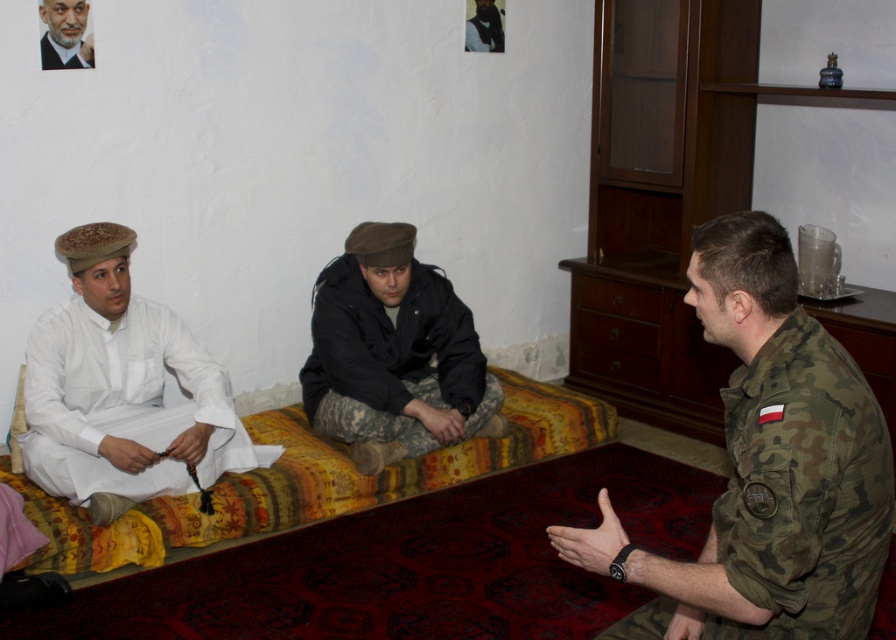
From the picture: Can you confirm if carpeted couch at center is thinner than smooth white robe at left?

No, carpeted couch at center is not thinner than smooth white robe at left.

Does point (291, 525) come closer to viewer compared to point (80, 42)?

No.

Locate an element on the screen. Image resolution: width=896 pixels, height=640 pixels. carpeted couch at center is located at coordinates (306, 481).

What are the coordinates of `carpeted couch at center` in the screenshot? It's located at (306, 481).

Does point (289, 433) come behind point (461, 336)?

No.

Where is `carpeted couch at center`? This screenshot has height=640, width=896. carpeted couch at center is located at coordinates (306, 481).

Is carpeted couch at center to the right of dark brown leather jacket at upper center from the viewer's perspective?

Incorrect, carpeted couch at center is not on the right side of dark brown leather jacket at upper center.

Is carpeted couch at center shorter than dark brown leather jacket at upper center?

Incorrect, carpeted couch at center's height does not fall short of dark brown leather jacket at upper center's.

Does point (583, 410) come farther from viewer compared to point (475, 4)?

No, it is not.

You are a GUI agent. You are given a task and a screenshot of the screen. Output one action in this format:
    pyautogui.click(x=<x>, y=<y>)
    Task: Click on the carpeted couch at center
    The image size is (896, 640).
    Given the screenshot: What is the action you would take?
    pos(306,481)